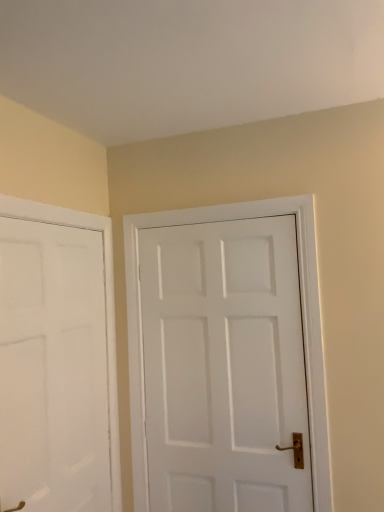
Describe the element at coordinates (53, 368) in the screenshot. I see `white matte door at left, acting as the first door starting from the left` at that location.

This screenshot has height=512, width=384. I want to click on white matte door at left, acting as the first door starting from the left, so click(x=53, y=368).

This screenshot has width=384, height=512. What are the coordinates of `white matte door at center, which is the 1th door in right-to-left order` in the screenshot? It's located at (224, 366).

What do you see at coordinates (224, 366) in the screenshot?
I see `white matte door at center, which ranks as the 2th door in left-to-right order` at bounding box center [224, 366].

In order to face white matte door at center, which is the 1th door in right-to-left order, should I rotate leftwards or rightwards?

Rotate right and turn 3.325 degrees.

Where is `white matte door at left, placed as the 2th door when sorted from right to left`? This screenshot has height=512, width=384. white matte door at left, placed as the 2th door when sorted from right to left is located at coordinates (53, 368).

Is white matte door at left, acting as the first door starting from the left, to the right of white matte door at center, which ranks as the 2th door in left-to-right order, from the viewer's perspective?

No, white matte door at left, acting as the first door starting from the left, is not to the right of white matte door at center, which ranks as the 2th door in left-to-right order.

Is the depth of white matte door at left, acting as the first door starting from the left, greater than that of white matte door at center, which is the 1th door in right-to-left order?

No, it is not.

Which is farther from the camera, (x=76, y=291) or (x=190, y=244)?

The point (x=190, y=244) is farther.

From the image's perspective, is white matte door at left, acting as the first door starting from the left, beneath white matte door at center, which ranks as the 2th door in left-to-right order?

Yes, from the image's perspective, white matte door at left, acting as the first door starting from the left, is beneath white matte door at center, which ranks as the 2th door in left-to-right order.

From a real-world perspective, is white matte door at left, acting as the first door starting from the left, physically located above or below white matte door at center, which ranks as the 2th door in left-to-right order?

From a real-world perspective, white matte door at left, acting as the first door starting from the left, is physically above white matte door at center, which ranks as the 2th door in left-to-right order.

Between white matte door at left, placed as the 2th door when sorted from right to left, and white matte door at center, which is the 1th door in right-to-left order, which one has larger width?

white matte door at center, which is the 1th door in right-to-left order.

Who is shorter, white matte door at left, acting as the first door starting from the left, or white matte door at center, which is the 1th door in right-to-left order?

Standing shorter between the two is white matte door at left, acting as the first door starting from the left.

Who is smaller, white matte door at left, placed as the 2th door when sorted from right to left, or white matte door at center, which is the 1th door in right-to-left order?

Smaller between the two is white matte door at left, placed as the 2th door when sorted from right to left.

Can white matte door at center, which is the 1th door in right-to-left order, be found inside white matte door at left, placed as the 2th door when sorted from right to left?

No, white matte door at left, placed as the 2th door when sorted from right to left, does not contain white matte door at center, which is the 1th door in right-to-left order.

Are white matte door at left, acting as the first door starting from the left, and white matte door at center, which is the 1th door in right-to-left order, far apart?

They are positioned close to each other.

Is white matte door at left, acting as the first door starting from the left, turned away from white matte door at center, which ranks as the 2th door in left-to-right order?

No, white matte door at left, acting as the first door starting from the left, is not facing away from white matte door at center, which ranks as the 2th door in left-to-right order.

Can you tell me how much white matte door at left, acting as the first door starting from the left, and white matte door at center, which ranks as the 2th door in left-to-right order, differ in facing direction?

There is a 90.2-degree angle between the facing directions of white matte door at left, acting as the first door starting from the left, and white matte door at center, which ranks as the 2th door in left-to-right order.

Measure the distance from white matte door at left, acting as the first door starting from the left, to white matte door at center, which ranks as the 2th door in left-to-right order.

white matte door at left, acting as the first door starting from the left, is 20.98 inches from white matte door at center, which ranks as the 2th door in left-to-right order.

Identify the location of door below the white matte door at center, which ranks as the 2th door in left-to-right order (from the image's perspective). (53, 368).

Considering the relative positions of white matte door at center, which ranks as the 2th door in left-to-right order, and white matte door at left, placed as the 2th door when sorted from right to left, in the image provided, is white matte door at center, which ranks as the 2th door in left-to-right order, to the left of white matte door at left, placed as the 2th door when sorted from right to left, from the viewer's perspective?

In fact, white matte door at center, which ranks as the 2th door in left-to-right order, is to the right of white matte door at left, placed as the 2th door when sorted from right to left.

Which object is further away from the camera, white matte door at center, which ranks as the 2th door in left-to-right order, or white matte door at left, placed as the 2th door when sorted from right to left?

Positioned behind is white matte door at center, which ranks as the 2th door in left-to-right order.

Between point (288, 245) and point (78, 472), which one is positioned in front?

The point (78, 472) is in front.

From the image's perspective, who appears lower, white matte door at center, which ranks as the 2th door in left-to-right order, or white matte door at left, placed as the 2th door when sorted from right to left?

white matte door at left, placed as the 2th door when sorted from right to left, from the image's perspective.

From a real-world perspective, which object stands above the other?

white matte door at left, placed as the 2th door when sorted from right to left, is physically above.

Considering the sizes of objects white matte door at center, which is the 1th door in right-to-left order, and white matte door at left, acting as the first door starting from the left, in the image provided, who is thinner, white matte door at center, which is the 1th door in right-to-left order, or white matte door at left, acting as the first door starting from the left,?

white matte door at left, acting as the first door starting from the left.

Which of these two, white matte door at center, which ranks as the 2th door in left-to-right order, or white matte door at left, placed as the 2th door when sorted from right to left, stands shorter?

With less height is white matte door at left, placed as the 2th door when sorted from right to left.

Can you confirm if white matte door at center, which ranks as the 2th door in left-to-right order, is bigger than white matte door at left, acting as the first door starting from the left?

Indeed, white matte door at center, which ranks as the 2th door in left-to-right order, has a larger size compared to white matte door at left, acting as the first door starting from the left.

Is white matte door at center, which is the 1th door in right-to-left order, not inside white matte door at left, acting as the first door starting from the left?

That's correct, white matte door at center, which is the 1th door in right-to-left order, is outside of white matte door at left, acting as the first door starting from the left.

Is white matte door at center, which is the 1th door in right-to-left order, far from white matte door at left, acting as the first door starting from the left?

white matte door at center, which is the 1th door in right-to-left order, is near white matte door at left, acting as the first door starting from the left, not far away.

Is white matte door at center, which is the 1th door in right-to-left order, positioned with its back to white matte door at left, acting as the first door starting from the left?

white matte door at center, which is the 1th door in right-to-left order, is not turned away from white matte door at left, acting as the first door starting from the left.

What's the angular difference between white matte door at center, which is the 1th door in right-to-left order, and white matte door at left, acting as the first door starting from the left,'s facing directions?

They differ by 90.2 degrees in their facing directions.

This screenshot has width=384, height=512. I want to click on door that is behind the white matte door at left, acting as the first door starting from the left, so click(224, 366).

This screenshot has width=384, height=512. What are the coordinates of `door above the white matte door at center, which ranks as the 2th door in left-to-right order (from a real-world perspective)` in the screenshot? It's located at (53, 368).

Image resolution: width=384 pixels, height=512 pixels. I want to click on door in front of the white matte door at center, which is the 1th door in right-to-left order, so click(53, 368).